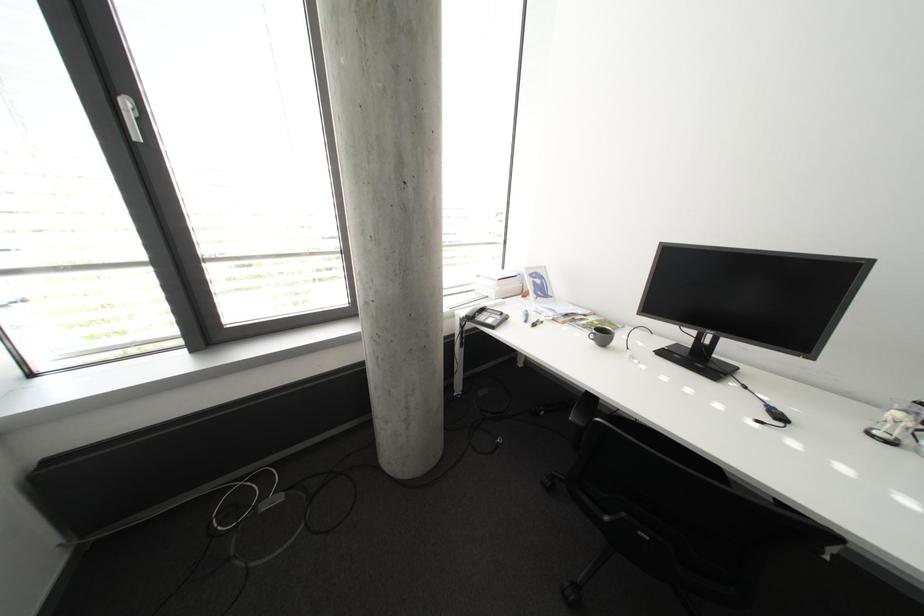
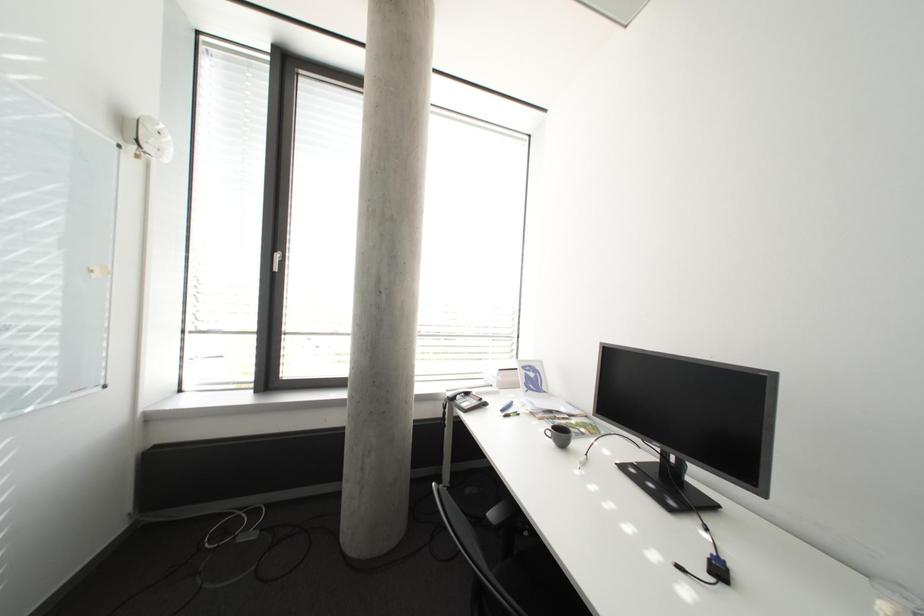
Question: Which direction would the cameraman need to move to produce the second image? Reply with the corresponding letter.

Choices:
 (A) Left
 (B) Right
 (C) Forward
 (D) Backward

Answer: (B)